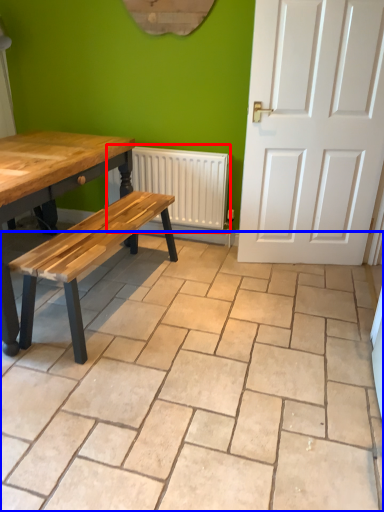
Question: Which of the following is the closest to the observer, radiator (highlighted by a red box) or ceramic tile (highlighted by a blue box)?

Choices:
 (A) radiator
 (B) ceramic tile

Answer: (B)